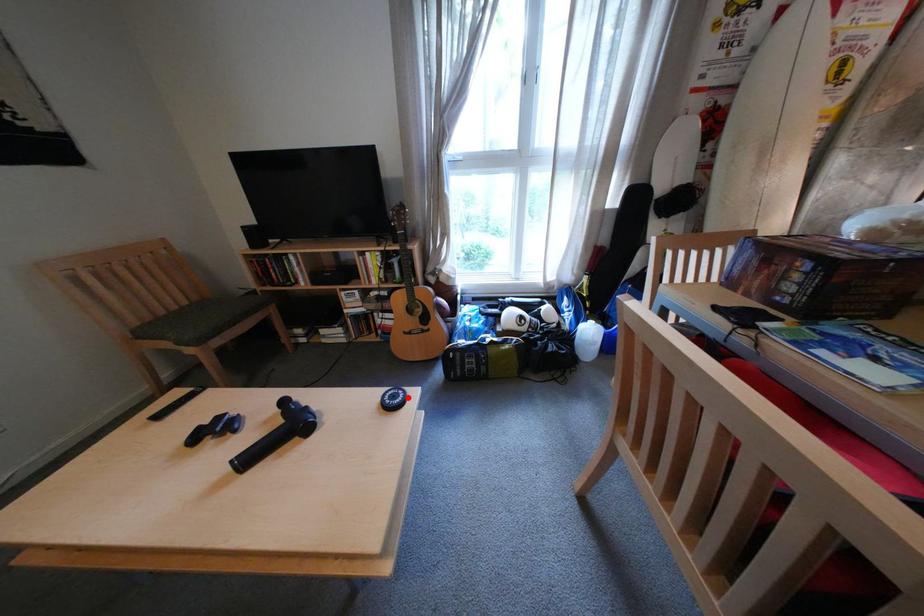
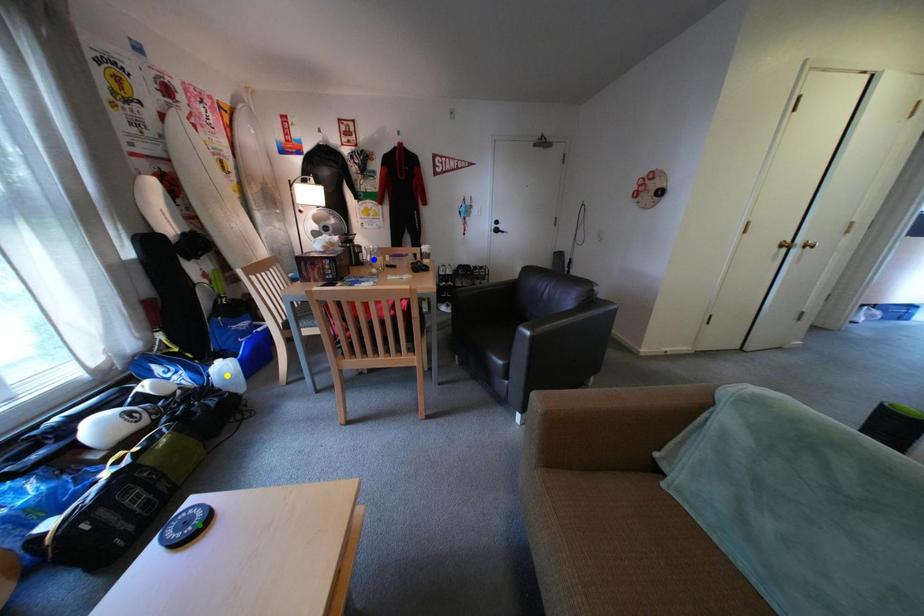
Question: I am providing you with two images of the same scene from different viewpoints. A red point is marked on the first image. You are given multiple points on the second image. Which mark in image 2 goes with the point in image 1?

Choices:
 (A) yellow point
 (B) blue point
 (C) green point

Answer: (C)